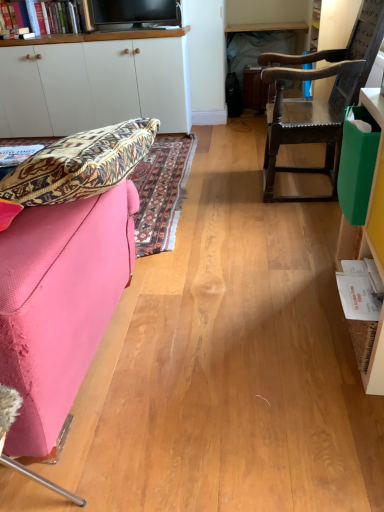
The width and height of the screenshot is (384, 512). Find the location of `vacant space that is to the left of green plastic bag at right, arranged as the first cabinetry when viewed from the right`. vacant space that is to the left of green plastic bag at right, arranged as the first cabinetry when viewed from the right is located at coordinates (266, 326).